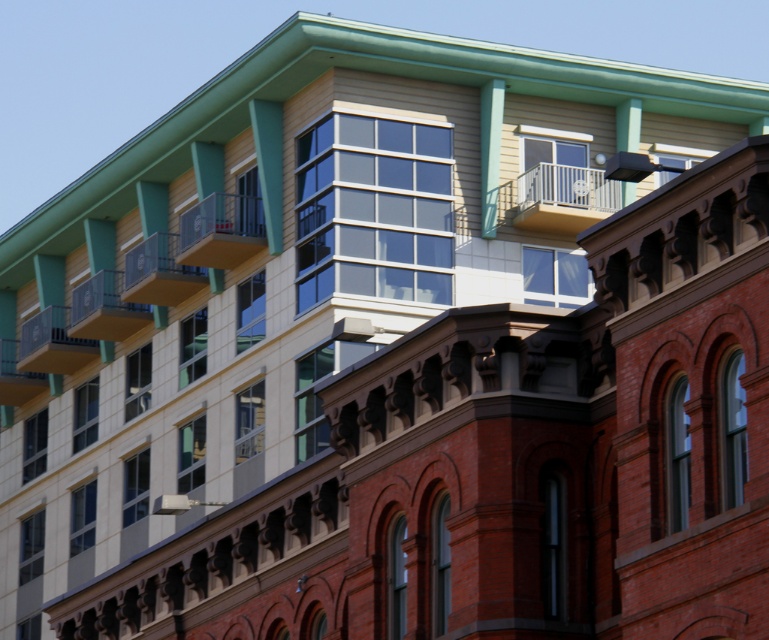
You are standing in the middle of the image and want to walk towards the point that is closer to the front. Which point should you head towards, point (510, 212) or point (105, 294)?

You should head towards point (510, 212) because it is in front of point (105, 294) according to the description.

From the picture: You are standing in the middle of the street looking at the two buildings. Which balcony, the white metal balcony at upper center or the smooth black balcony at lower left, is positioned to the east side of the other?

The white metal balcony at upper center is to the east of the smooth black balcony at lower left because it is positioned to the right of it in the image, and since you are facing the buildings, right corresponds to east.